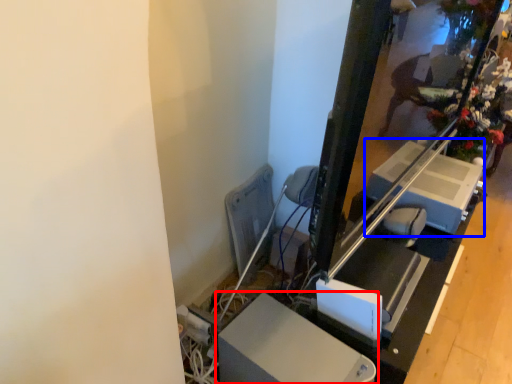
Question: Which of the following is the closest to the observer, furniture (highlighted by a red box) or lift (highlighted by a blue box)?

Choices:
 (A) furniture
 (B) lift

Answer: (A)